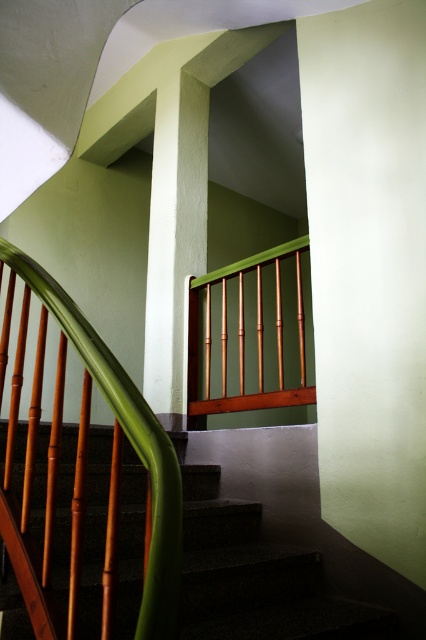
You are standing at the bottom of the staircase and want to reach the top. You notice two points marked on the wall. Which point is closer to you, point (285, 630) or point (203, 198)?

Point (285, 630) is closer to the viewer than point (203, 198).

You are standing at the bottom of the staircase and want to reach the top. Which object, the matte green wall at center or the smooth concrete stairs at center, will you encounter first as you climb?

You will encounter the smooth concrete stairs at center first because the matte green wall at center is further away from you, meaning the stairs are closer and in your path upwards.

You are a delivery person carrying a large box that is 3.5 feet wide. You need to navigate through the space between the smooth concrete stairs at center and the smooth white pillar at center. Can your box fit through this space without tilting it sideways?

The distance between the smooth concrete stairs at center and the smooth white pillar at center is 4.35 feet. Since the box is 3.5 feet wide, it can fit through the space as there is enough clearance.